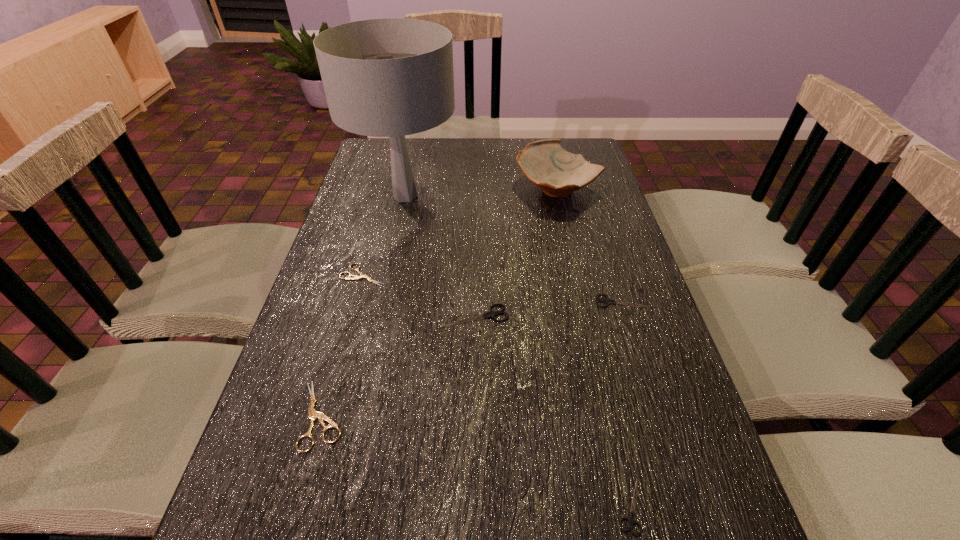
Identify which object is located as the fourth nearest to the second black shears from right to left. Please provide its 2D coordinates. Your answer should be formatted as a tuple, i.e. [(x, y)], where the tuple contains the x and y coordinates of a point satisfying the conditions above.

[(355, 277)]

This screenshot has height=540, width=960. What are the coordinates of `shears that is the closest to the second smallest black shears` in the screenshot? It's located at (492, 314).

Where is `the fourth closest shears relative to the sixth shortest object`? The width and height of the screenshot is (960, 540). the fourth closest shears relative to the sixth shortest object is located at coordinates (312, 413).

At what (x,y) coordinates should I click in order to perform the action: click on black shears object that ranks as the second closest to the farther beige shears. Please return your answer as a coordinate pair (x, y). Looking at the image, I should click on (607, 301).

Identify which black shears is the nearest to the fifth shortest object. Please provide its 2D coordinates. Your answer should be formatted as a tuple, i.e. [(x, y)], where the tuple contains the x and y coordinates of a point satisfying the conditions above.

[(607, 301)]

The width and height of the screenshot is (960, 540). I want to click on beige shears identified as the closest to the second biggest black shears, so click(x=355, y=277).

Select which beige shears appears as the second closest to the rightmost shears. Please provide its 2D coordinates. Your answer should be formatted as a tuple, i.e. [(x, y)], where the tuple contains the x and y coordinates of a point satisfying the conditions above.

[(312, 413)]

Find the location of `vacant space that satisfies the following two spatial constraints: 1. on the front side of the nearest object; 2. on the right side of the biggest black shears`. vacant space that satisfies the following two spatial constraints: 1. on the front side of the nearest object; 2. on the right side of the biggest black shears is located at coordinates (474, 507).

The width and height of the screenshot is (960, 540). I want to click on blank space that satisfies the following two spatial constraints: 1. on the front side of the second black shears from right to left; 2. on the left side of the nearer beige shears, so click(296, 507).

Locate an element on the screen. free region that satisfies the following two spatial constraints: 1. on the front side of the smallest black shears; 2. on the left side of the farther beige shears is located at coordinates tap(300, 507).